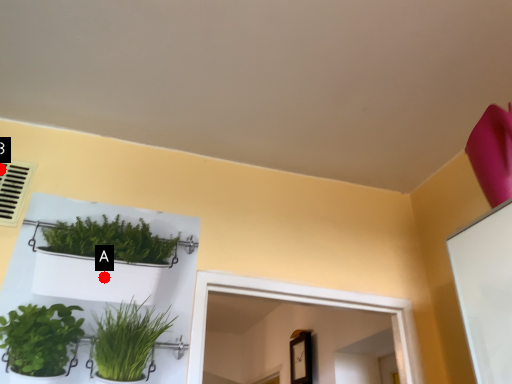
Question: Two points are circled on the image, labeled by A and B beside each circle. Which point is farther from the camera taking this photo?

Choices:
 (A) A is further
 (B) B is further

Answer: (B)